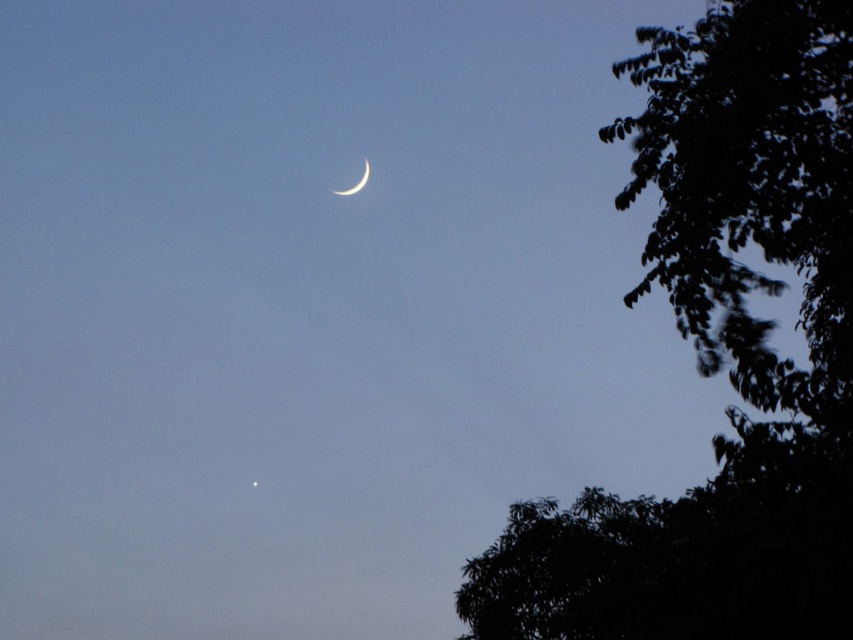
You are an astronomer observing the night sky. You notice the dark green leafy tree at upper right and the satin silver crescent at upper center. Which object is positioned higher in the sky?

The satin silver crescent at upper center is positioned higher in the sky than the dark green leafy tree at upper right.

You are an astronomer observing the night sky. You notice the dark green leafy tree at upper right and the satin silver crescent at upper center. Which object is closer to your viewpoint?

The dark green leafy tree at upper right is closer to your viewpoint because it is in front of the satin silver crescent at upper center.

You are an astronomer trying to determine the relative sizes of celestial objects in the night sky. Given that you observe the dark green leafy tree at upper right and the satin silver crescent at upper center, which object appears wider in the sky?

The dark green leafy tree at upper right appears wider than the satin silver crescent at upper center.